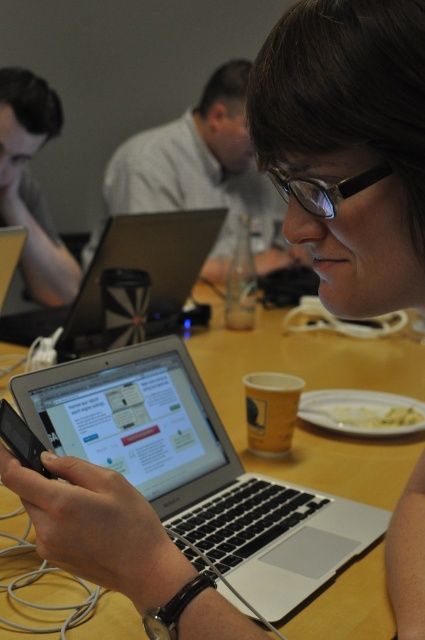
Does matte black laptop at left have a lesser width compared to black plastic smartphone at center?

No.

Is matte black laptop at left to the right of black plastic smartphone at center from the viewer's perspective?

No, matte black laptop at left is not to the right of black plastic smartphone at center.

Image resolution: width=425 pixels, height=640 pixels. What do you see at coordinates (31, 186) in the screenshot? I see `matte black laptop at left` at bounding box center [31, 186].

Identify the location of matte black laptop at left. (31, 186).

Is satin black laptop at center positioned in front of black plastic smartphone at center?

No, satin black laptop at center is further to the viewer.

Looking at this image, which is below, satin black laptop at center or black plastic smartphone at center?

black plastic smartphone at center is below.

Is point (85, 316) farther from viewer compared to point (42, 472)?

Yes, it is behind point (42, 472).

At what (x,y) coordinates should I click in order to perform the action: click on satin black laptop at center. Please return your answer as a coordinate pair (x, y). This screenshot has height=640, width=425. Looking at the image, I should click on (129, 268).

Who is shorter, matte white shirt at upper center or transparent plastic glasses at center?

Standing shorter between the two is transparent plastic glasses at center.

Does matte white shirt at upper center appear on the right side of transparent plastic glasses at center?

In fact, matte white shirt at upper center is to the left of transparent plastic glasses at center.

Which is behind, point (238, 102) or point (382, 161)?

The point (238, 102) is behind.

Locate an element on the screen. The height and width of the screenshot is (640, 425). matte white shirt at upper center is located at coordinates [201, 176].